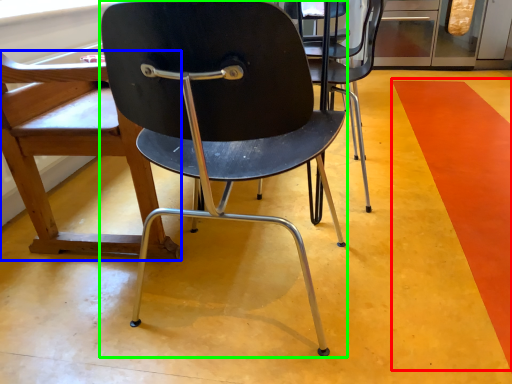
Question: Which object is positioned farthest from strip (highlighted by a red box)? Select from chair (highlighted by a blue box) and chair (highlighted by a green box).

Choices:
 (A) chair
 (B) chair

Answer: (A)